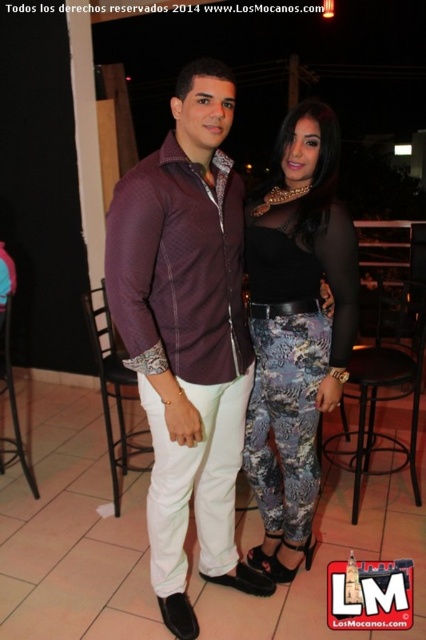
Question: Is metallic silver pants at center further to camera compared to black metal bar stool at lower right?

Choices:
 (A) yes
 (B) no

Answer: (B)

Question: Which object is closer to the camera taking this photo?

Choices:
 (A) matte purple shirt at center
 (B) black metal bar stool at lower right

Answer: (A)

Question: Which object is farther from the camera taking this photo?

Choices:
 (A) black metal bar stool at lower right
 (B) matte purple shirt at center

Answer: (A)

Question: Which object is positioned closest to the matte purple shirt at center?

Choices:
 (A) metallic silver pants at center
 (B) black metal bar stool at lower right

Answer: (A)

Question: Is matte purple shirt at center bigger than metallic silver pants at center?

Choices:
 (A) yes
 (B) no

Answer: (A)

Question: Where is metallic silver pants at center located in relation to black metal bar stool at lower right in the image?

Choices:
 (A) right
 (B) left

Answer: (B)